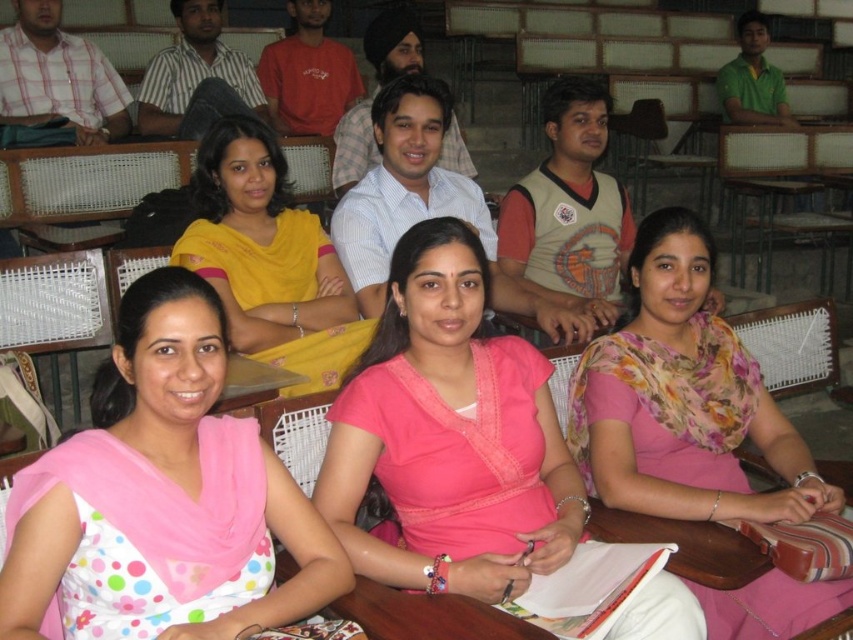
Which is more to the right, pink satin blouse at center or pink polka dot blouse at lower left?

Positioned to the right is pink satin blouse at center.

Which is below, pink satin blouse at center or pink polka dot blouse at lower left?

pink satin blouse at center

Describe the element at coordinates (450, 436) in the screenshot. The image size is (853, 640). I see `pink satin blouse at center` at that location.

Find the location of `pink satin blouse at center`. pink satin blouse at center is located at coordinates (450, 436).

You are a GUI agent. You are given a task and a screenshot of the screen. Output one action in this format:
    pyautogui.click(x=<x>, y=<y>)
    Task: Click on the pink polka dot blouse at lower left
    This screenshot has height=640, width=853.
    Given the screenshot: What is the action you would take?
    pyautogui.click(x=166, y=484)

Can you confirm if pink polka dot blouse at lower left is thinner than yellow fabric saree at center?

In fact, pink polka dot blouse at lower left might be wider than yellow fabric saree at center.

This screenshot has height=640, width=853. Identify the location of pink polka dot blouse at lower left. tap(166, 484).

Does pink polka dot blouse at lower left have a greater height compared to floral fabric saree at center?

Incorrect, pink polka dot blouse at lower left's height is not larger of floral fabric saree at center's.

Can you confirm if pink polka dot blouse at lower left is positioned to the right of floral fabric saree at center?

Incorrect, pink polka dot blouse at lower left is not on the right side of floral fabric saree at center.

Which is behind, point (178, 582) or point (657, 333)?

The point (657, 333) is more distant.

In order to click on pink polka dot blouse at lower left in this screenshot , I will do `click(166, 484)`.